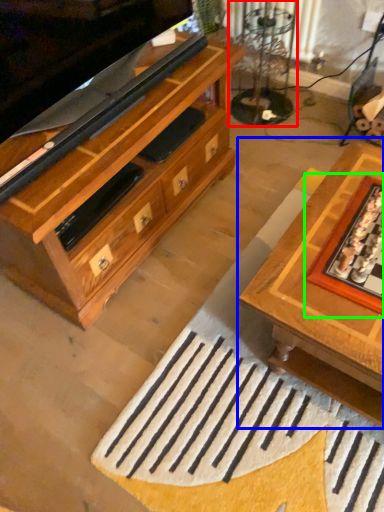
Question: Estimate the real-world distances between objects in this image. Which object is farther from glass table (highlighted by a red box), table (highlighted by a blue box) or board game (highlighted by a green box)?

Choices:
 (A) table
 (B) board game

Answer: (B)